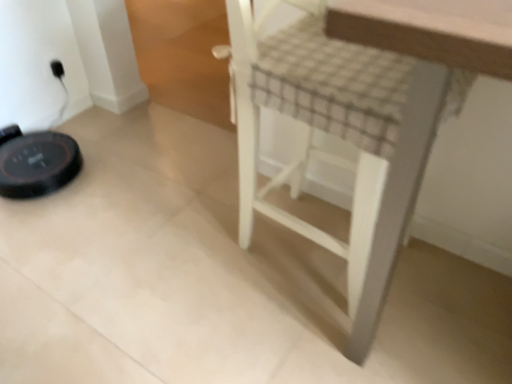
At what (x,y) coordinates should I click in order to perform the action: click on free location to the left of white wood stool at center. Please return your answer as a coordinate pair (x, y). Looking at the image, I should click on (186, 258).